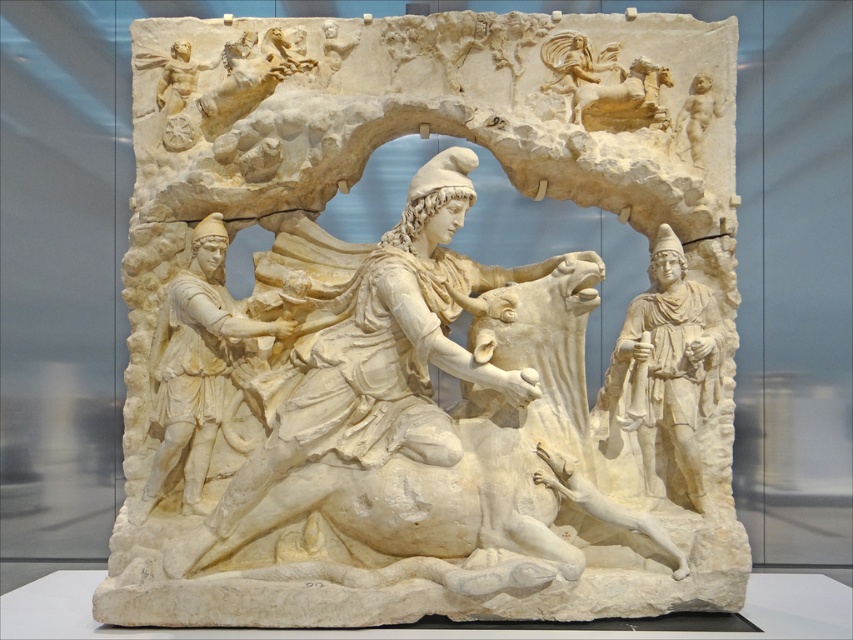
Question: Which object appears farthest from the camera in this image?

Choices:
 (A) smooth beige cherub at upper right
 (B) white marble figure at right

Answer: (A)

Question: Which object is positioned closest to the smooth beige cherub at upper right?

Choices:
 (A) white marble figure at center
 (B) white marble sculpture at center

Answer: (B)

Question: Is white marble sculpture at center in front of white marble figure at center?

Choices:
 (A) yes
 (B) no

Answer: (A)

Question: Which of the following is the closest to the observer?

Choices:
 (A) white marble sculpture at center
 (B) white marble figure at center

Answer: (A)

Question: Considering the relative positions of white marble sculpture at center and smooth beige cherub at upper right in the image provided, where is white marble sculpture at center located with respect to smooth beige cherub at upper right?

Choices:
 (A) left
 (B) right

Answer: (A)

Question: Is white marble figure at center above white marble figure at right?

Choices:
 (A) yes
 (B) no

Answer: (B)